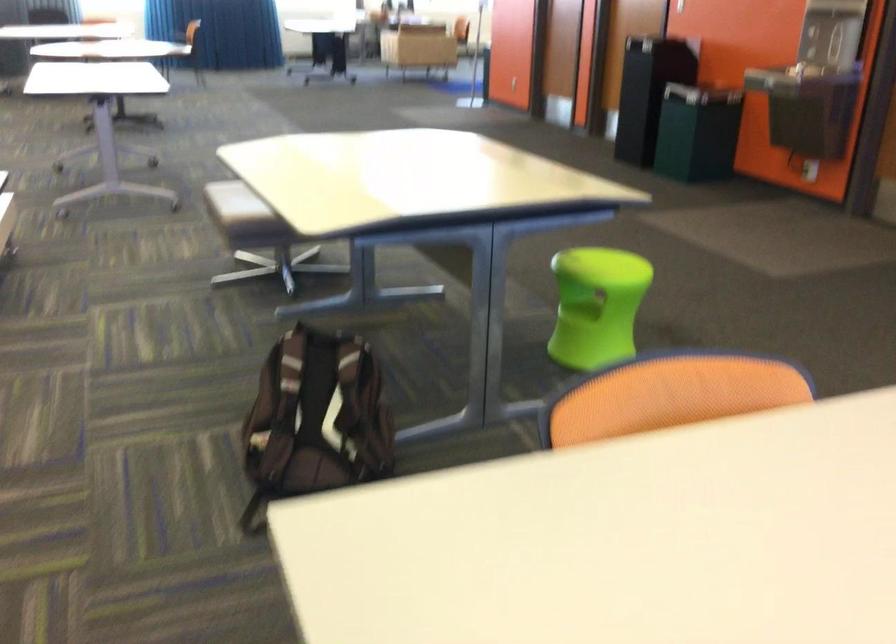
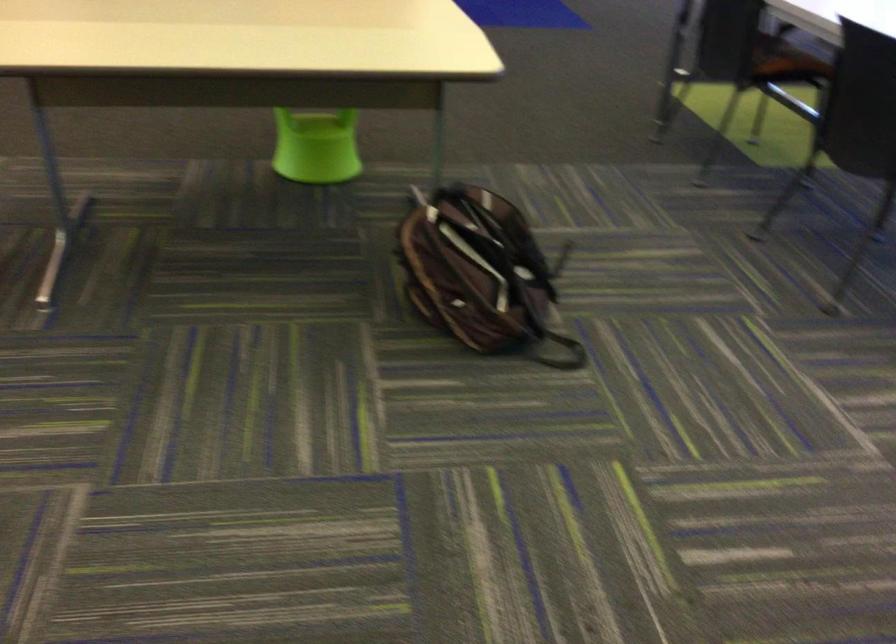
Where in the second image is the point corresponding to (x=280, y=193) from the first image?

(322, 67)